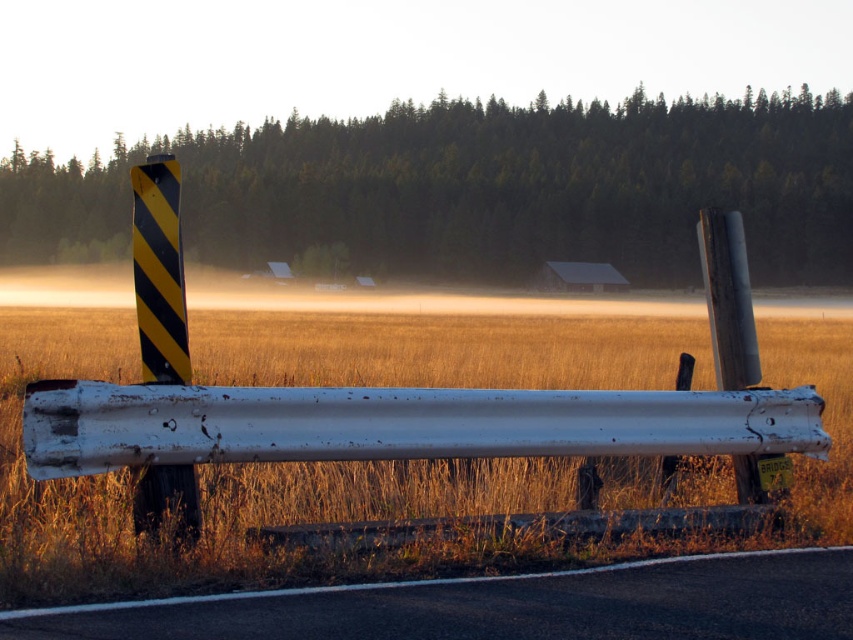
Which is above, white metal guardrail at center or black asphalt road at lower center?

white metal guardrail at center is above.

Between white metal guardrail at center and black asphalt road at lower center, which one has more height?

white metal guardrail at center

At what (x,y) coordinates should I click in order to perform the action: click on white metal guardrail at center. Please return your answer as a coordinate pair (x, y). Looking at the image, I should click on (397, 422).

Measure the distance from foggy mist at upper center to white metal guardrail at center.

foggy mist at upper center and white metal guardrail at center are 83.81 meters apart from each other.

Which of these two, foggy mist at upper center or white metal guardrail at center, stands taller?

foggy mist at upper center

The image size is (853, 640). I want to click on foggy mist at upper center, so click(480, 189).

Find the location of a particular element. Image resolution: width=853 pixels, height=640 pixels. foggy mist at upper center is located at coordinates (480, 189).

Between dry grass at center and yellow-black striped pole at left, which one has more height?

With more height is yellow-black striped pole at left.

Does point (32, 349) lie behind point (166, 209)?

Yes, it is.

Is point (354, 502) farther from viewer compared to point (177, 266)?

Yes.

At what (x,y) coordinates should I click in order to perform the action: click on dry grass at center. Please return your answer as a coordinate pair (x, y). Looking at the image, I should click on (337, 486).